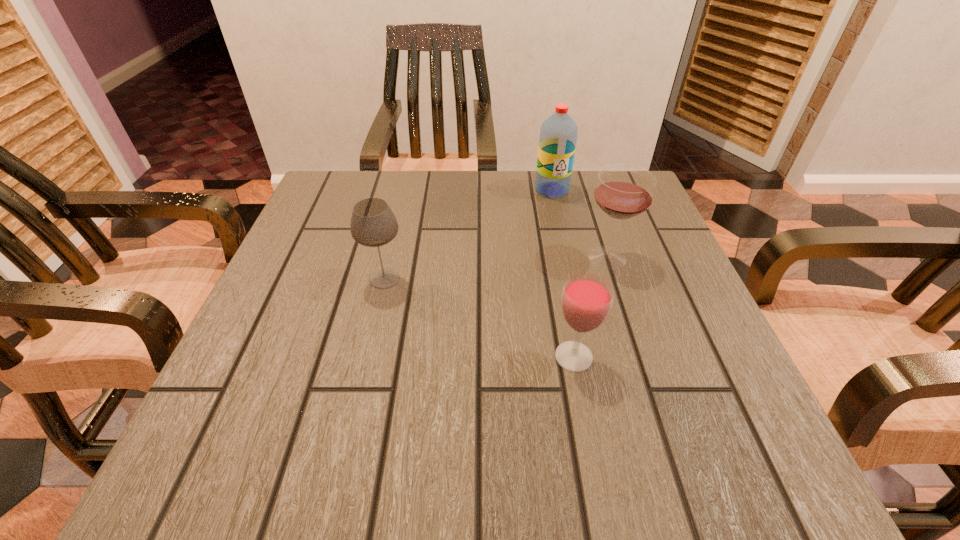
Locate an element on the screen. This screenshot has width=960, height=540. object positioned at the right edge is located at coordinates (624, 191).

Image resolution: width=960 pixels, height=540 pixels. In the image, there is a desktop. In order to click on vacant area at the far edge in this screenshot , I will do `click(396, 207)`.

This screenshot has height=540, width=960. Find the location of `vacant space at the near edge of the desktop`. vacant space at the near edge of the desktop is located at coordinates (449, 428).

Where is `free space at the left edge`? The image size is (960, 540). free space at the left edge is located at coordinates (326, 346).

This screenshot has height=540, width=960. I want to click on free location at the right edge of the desktop, so pyautogui.click(x=661, y=302).

The height and width of the screenshot is (540, 960). In order to click on free space at the far left corner of the desktop in this screenshot , I will do `click(326, 223)`.

The height and width of the screenshot is (540, 960). In the image, there is a desktop. Find the location of `blank space at the near left corner`. blank space at the near left corner is located at coordinates (246, 444).

This screenshot has height=540, width=960. In order to click on blank space at the far right corner of the desktop in this screenshot , I will do `click(574, 185)`.

Image resolution: width=960 pixels, height=540 pixels. In the image, there is a desktop. Find the location of `vacant space at the near right corner`. vacant space at the near right corner is located at coordinates (713, 437).

You are a GUI agent. You are given a task and a screenshot of the screen. Output one action in this format:
    pyautogui.click(x=<x>, y=<y>)
    Task: Click on the blank region between the water bottle and the nearest object
    The width and height of the screenshot is (960, 540).
    Given the screenshot: What is the action you would take?
    pyautogui.click(x=563, y=273)